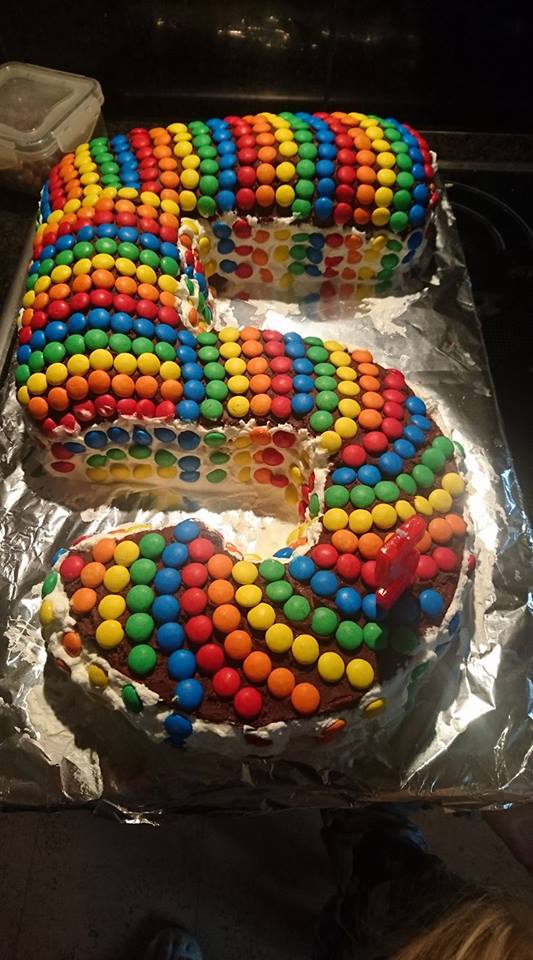
Find the location of a particular element. The width and height of the screenshot is (533, 960). wick at top of candle is located at coordinates (401, 533).